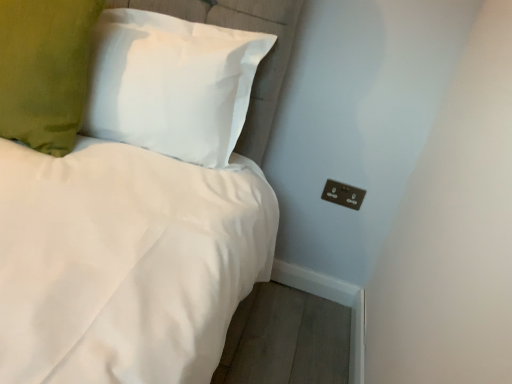
Describe the element at coordinates (343, 194) in the screenshot. I see `black plastic outlet at lower right` at that location.

Where is `black plastic outlet at lower right`? This screenshot has height=384, width=512. black plastic outlet at lower right is located at coordinates (343, 194).

How far apart are green velvet pillow at upper left, arranged as the first pillow when viewed from the left, and black plastic outlet at lower right?

green velvet pillow at upper left, arranged as the first pillow when viewed from the left, is 39.00 inches away from black plastic outlet at lower right.

The height and width of the screenshot is (384, 512). Identify the location of the 2nd pillow above the black plastic outlet at lower right (from the image's perspective). (45, 70).

From the image's perspective, which one is positioned lower, green velvet pillow at upper left, the second pillow from the right, or black plastic outlet at lower right?

black plastic outlet at lower right.

From the picture: Would you say green velvet pillow at upper left, the second pillow from the right, contains black plastic outlet at lower right?

No.

Is point (230, 53) closer to viewer compared to point (337, 189)?

Yes, it is in front of point (337, 189).

Is white fabric pillow at upper left, the 1th pillow from the right, further to camera compared to black plastic outlet at lower right?

No, it is not.

In the scene shown: Considering the sizes of white fabric pillow at upper left, which is counted as the second pillow, starting from the left, and black plastic outlet at lower right in the image, is white fabric pillow at upper left, which is counted as the second pillow, starting from the left, bigger or smaller than black plastic outlet at lower right?

Clearly, white fabric pillow at upper left, which is counted as the second pillow, starting from the left, is larger in size than black plastic outlet at lower right.

Between green velvet pillow at upper left, the second pillow from the right, and white fabric pillow at upper left, which is counted as the second pillow, starting from the left, which one has smaller width?

With smaller width is white fabric pillow at upper left, which is counted as the second pillow, starting from the left.

In the scene shown: Is green velvet pillow at upper left, the second pillow from the right, surrounding white fabric pillow at upper left, the 1th pillow from the right?

No, white fabric pillow at upper left, the 1th pillow from the right, is not inside green velvet pillow at upper left, the second pillow from the right.

Between green velvet pillow at upper left, the second pillow from the right, and white fabric pillow at upper left, the 1th pillow from the right, which one appears on the left side from the viewer's perspective?

green velvet pillow at upper left, the second pillow from the right, is more to the left.

Is black plastic outlet at lower right touching white fabric pillow at upper left, which is counted as the second pillow, starting from the left?

black plastic outlet at lower right and white fabric pillow at upper left, which is counted as the second pillow, starting from the left, are clearly separated.

Does black plastic outlet at lower right have a smaller size compared to white fabric pillow at upper left, which is counted as the second pillow, starting from the left?

Yes, black plastic outlet at lower right is smaller than white fabric pillow at upper left, which is counted as the second pillow, starting from the left.

Choose the correct answer: Is black plastic outlet at lower right inside white fabric pillow at upper left, the 1th pillow from the right, or outside it?

black plastic outlet at lower right cannot be found inside white fabric pillow at upper left, the 1th pillow from the right.

Considering the sizes of objects black plastic outlet at lower right and white fabric pillow at upper left, which is counted as the second pillow, starting from the left, in the image provided, who is taller, black plastic outlet at lower right or white fabric pillow at upper left, which is counted as the second pillow, starting from the left,?

white fabric pillow at upper left, which is counted as the second pillow, starting from the left, is taller.

Is black plastic outlet at lower right facing away from green velvet pillow at upper left, arranged as the first pillow when viewed from the left?

That's not correct — black plastic outlet at lower right is not looking away from green velvet pillow at upper left, arranged as the first pillow when viewed from the left.

Considering the sizes of objects black plastic outlet at lower right and green velvet pillow at upper left, arranged as the first pillow when viewed from the left, in the image provided, who is bigger, black plastic outlet at lower right or green velvet pillow at upper left, arranged as the first pillow when viewed from the left,?

Bigger between the two is green velvet pillow at upper left, arranged as the first pillow when viewed from the left.

From their relative heights in the image, would you say black plastic outlet at lower right is taller or shorter than green velvet pillow at upper left, the second pillow from the right?

black plastic outlet at lower right is shorter than green velvet pillow at upper left, the second pillow from the right.

Is point (339, 183) closer or farther from the camera than point (77, 15)?

Point (339, 183).

Is white fabric pillow at upper left, which is counted as the second pillow, starting from the left, not close to green velvet pillow at upper left, arranged as the first pillow when viewed from the left?

They are positioned close to each other.

Looking at the image, does white fabric pillow at upper left, the 1th pillow from the right, seem bigger or smaller compared to green velvet pillow at upper left, arranged as the first pillow when viewed from the left?

white fabric pillow at upper left, the 1th pillow from the right, is bigger than green velvet pillow at upper left, arranged as the first pillow when viewed from the left.

Considering the relative sizes of white fabric pillow at upper left, which is counted as the second pillow, starting from the left, and green velvet pillow at upper left, the second pillow from the right, in the image provided, is white fabric pillow at upper left, which is counted as the second pillow, starting from the left, taller than green velvet pillow at upper left, the second pillow from the right,?

No, white fabric pillow at upper left, which is counted as the second pillow, starting from the left, is not taller than green velvet pillow at upper left, the second pillow from the right.

Between white fabric pillow at upper left, which is counted as the second pillow, starting from the left, and green velvet pillow at upper left, the second pillow from the right, which one is positioned behind?

white fabric pillow at upper left, which is counted as the second pillow, starting from the left, is behind.

You are a GUI agent. You are given a task and a screenshot of the screen. Output one action in this format:
    pyautogui.click(x=<x>, y=<y>)
    Task: Click on the 2nd pillow counting from the left side of the black plastic outlet at lower right
    
    Given the screenshot: What is the action you would take?
    pyautogui.click(x=45, y=70)

The width and height of the screenshot is (512, 384). I want to click on the 1st pillow in front of the black plastic outlet at lower right, so (172, 84).

Based on their spatial positions, is black plastic outlet at lower right or green velvet pillow at upper left, the second pillow from the right, closer to white fabric pillow at upper left, which is counted as the second pillow, starting from the left?

green velvet pillow at upper left, the second pillow from the right.

Which object lies further to the anchor point green velvet pillow at upper left, arranged as the first pillow when viewed from the left, white fabric pillow at upper left, which is counted as the second pillow, starting from the left, or black plastic outlet at lower right?

Based on the image, black plastic outlet at lower right appears to be further to green velvet pillow at upper left, arranged as the first pillow when viewed from the left.

From the image, which object appears to be nearer to black plastic outlet at lower right, green velvet pillow at upper left, the second pillow from the right, or white fabric pillow at upper left, which is counted as the second pillow, starting from the left?

The object closer to black plastic outlet at lower right is white fabric pillow at upper left, which is counted as the second pillow, starting from the left.

Considering their positions, is white fabric pillow at upper left, which is counted as the second pillow, starting from the left, positioned further to black plastic outlet at lower right than green velvet pillow at upper left, arranged as the first pillow when viewed from the left?

green velvet pillow at upper left, arranged as the first pillow when viewed from the left, is further to black plastic outlet at lower right.

Looking at the image, which one is located closer to green velvet pillow at upper left, arranged as the first pillow when viewed from the left, black plastic outlet at lower right or white fabric pillow at upper left, which is counted as the second pillow, starting from the left?

white fabric pillow at upper left, which is counted as the second pillow, starting from the left.

Which object lies nearer to the anchor point white fabric pillow at upper left, the 1th pillow from the right, green velvet pillow at upper left, the second pillow from the right, or black plastic outlet at lower right?

green velvet pillow at upper left, the second pillow from the right, is positioned closer to the anchor white fabric pillow at upper left, the 1th pillow from the right.

The height and width of the screenshot is (384, 512). I want to click on pillow between green velvet pillow at upper left, arranged as the first pillow when viewed from the left, and black plastic outlet at lower right from left to right, so click(172, 84).